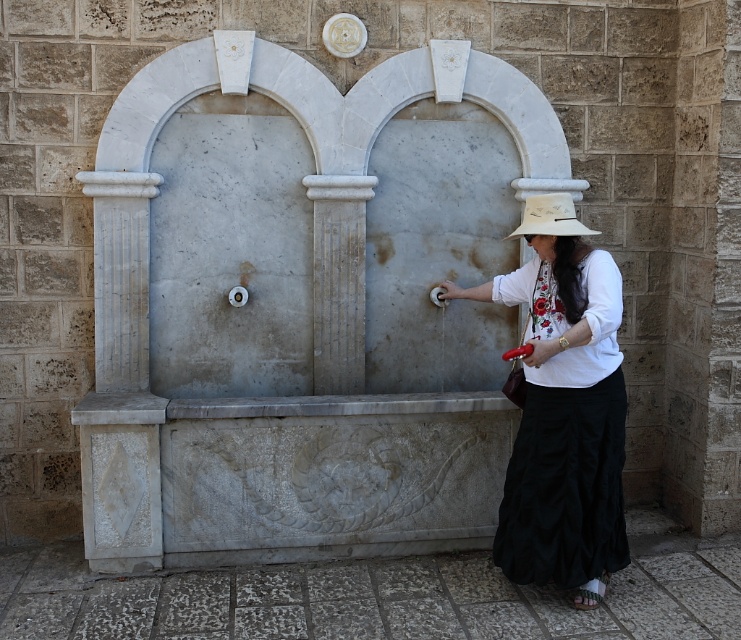
Looking at this image, is white marble pillar at center bigger than white fabric hat at right?

Indeed, white marble pillar at center has a larger size compared to white fabric hat at right.

Is white marble pillar at center below white fabric hat at right?

Yes.

The width and height of the screenshot is (741, 640). What are the coordinates of `white marble pillar at center` in the screenshot? It's located at (338, 280).

Between point (534, 522) and point (568, 216), which one is positioned in front?

Point (568, 216) is more forward.

Can you confirm if white cotton shirt at center is taller than white fabric hat at right?

Yes, white cotton shirt at center is taller than white fabric hat at right.

Who is more distant from viewer, [588,408] or [579,227]?

The point [579,227] is more distant.

The width and height of the screenshot is (741, 640). I want to click on white cotton shirt at center, so click(562, 408).

Is point (578, 579) more distant than point (353, 250)?

No, (578, 579) is in front of (353, 250).

Is white cotton shirt at center wider than white marble pillar at center?

Indeed, white cotton shirt at center has a greater width compared to white marble pillar at center.

What are the coordinates of `white cotton shirt at center` in the screenshot? It's located at (562, 408).